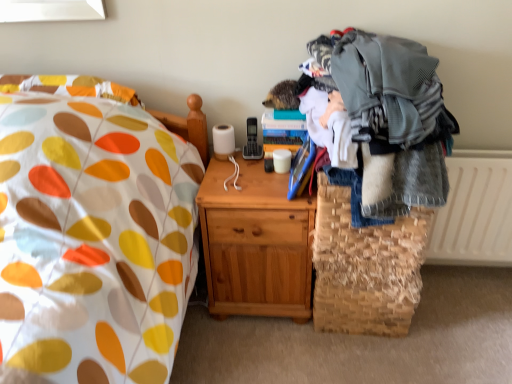
At what (x,y) coordinates should I click in order to perform the action: click on free spot to the right of woven straw basket at lower right. Please return your answer as a coordinate pair (x, y). This screenshot has width=512, height=384. Looking at the image, I should click on (449, 323).